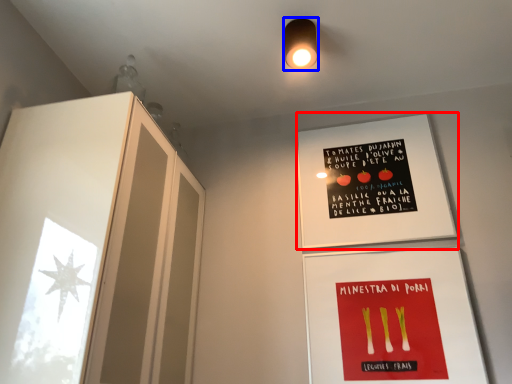
Question: Which of the following is the farthest to the observer, bulletin board (highlighted by a red box) or light fixture (highlighted by a blue box)?

Choices:
 (A) bulletin board
 (B) light fixture

Answer: (A)